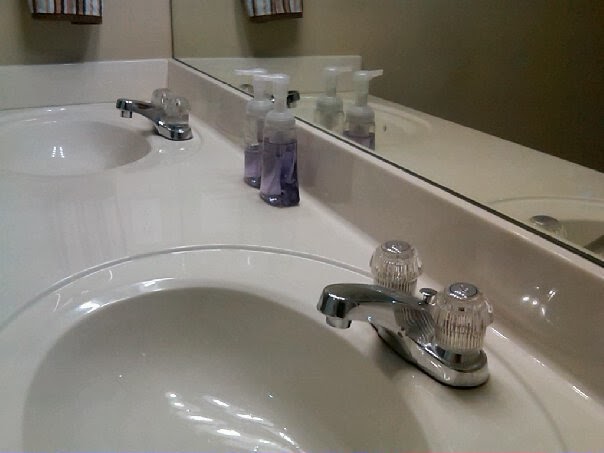
Locate an element on the screen. This screenshot has height=453, width=604. drain pull is located at coordinates (426, 294).